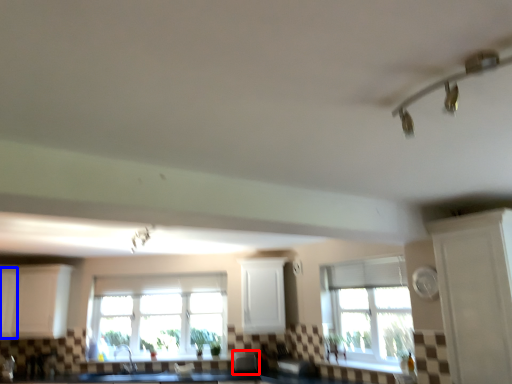
Question: Which object is closer to the camera taking this photo, appliance (highlighted by a red box) or cabinetry (highlighted by a blue box)?

Choices:
 (A) appliance
 (B) cabinetry

Answer: (A)